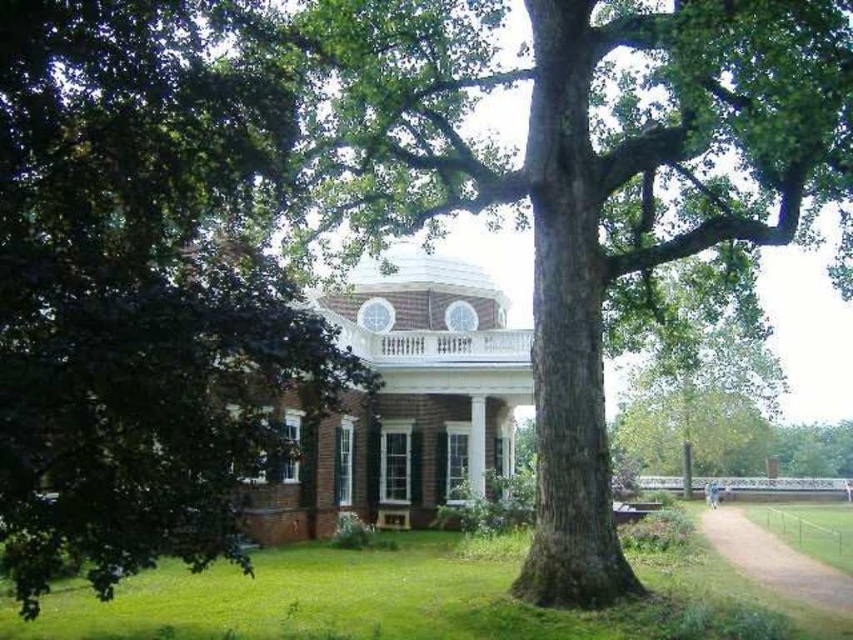
Who is more distant from viewer, (84, 54) or (851, 104)?

The point (851, 104) is behind.

Is green leafy tree at left below green rough bark tree at center?

Yes.

Which is behind, point (131, 554) or point (732, 36)?

The point (732, 36) is behind.

Identify the location of green leafy tree at left. This screenshot has width=853, height=640. (138, 289).

Which of these two, dirt/gravel path at lower right or white marble column at center, stands taller?

Standing taller between the two is dirt/gravel path at lower right.

The image size is (853, 640). Describe the element at coordinates (775, 561) in the screenshot. I see `dirt/gravel path at lower right` at that location.

Identify the location of dirt/gravel path at lower right. (775, 561).

Who is taller, green leafy tree at left or dirt/gravel path at lower right?

With more height is dirt/gravel path at lower right.

Describe the element at coordinates (138, 289) in the screenshot. I see `green leafy tree at left` at that location.

Identify the location of green leafy tree at left. click(x=138, y=289).